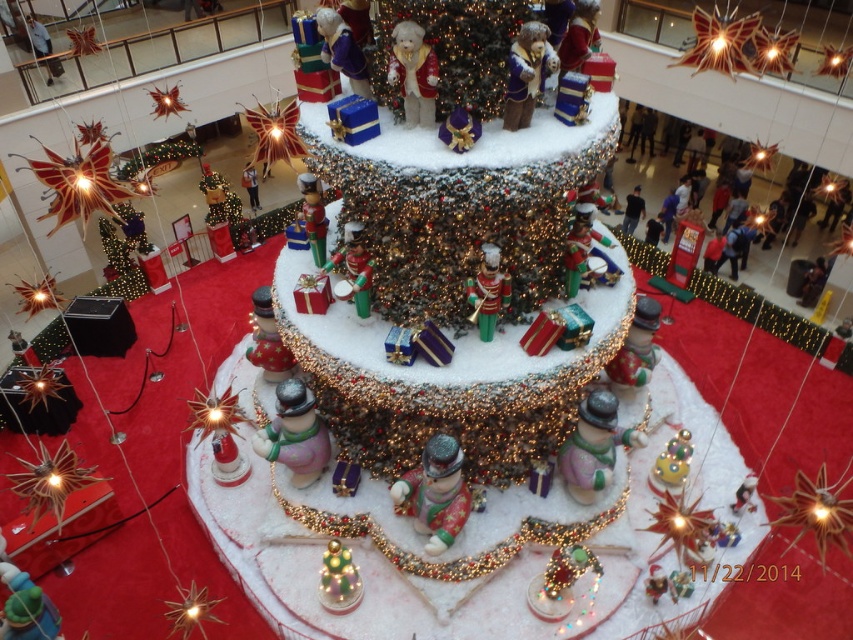
Who is shorter, porcelain figurine at center or shiny green plastic toy soldier at center?

Standing shorter between the two is shiny green plastic toy soldier at center.

Who is more distant from viewer, (271, 433) or (506, 278)?

The point (271, 433) is more distant.

The width and height of the screenshot is (853, 640). In order to click on porcelain figurine at center in this screenshot , I will do `click(294, 433)`.

Who is positioned more to the left, shiny silver figurine at center or fuzzy plush bear at center?

fuzzy plush bear at center is more to the left.

Which of these two, shiny silver figurine at center or fuzzy plush bear at center, stands taller?

shiny silver figurine at center

Is point (434, 490) positioned behind point (393, 77)?

Yes, point (434, 490) is farther from viewer.

Image resolution: width=853 pixels, height=640 pixels. Find the location of `shiny silver figurine at center`. shiny silver figurine at center is located at coordinates (434, 493).

Can you confirm if matte gold figurine at upper center is positioned above shiny green plastic toy soldier at center?

Yes, matte gold figurine at upper center is above shiny green plastic toy soldier at center.

Between matte gold figurine at upper center and shiny green plastic toy soldier at center, which one is positioned lower?

Positioned lower is shiny green plastic toy soldier at center.

Locate an element on the screen. This screenshot has width=853, height=640. matte gold figurine at upper center is located at coordinates (526, 74).

I want to click on matte gold figurine at upper center, so click(526, 74).